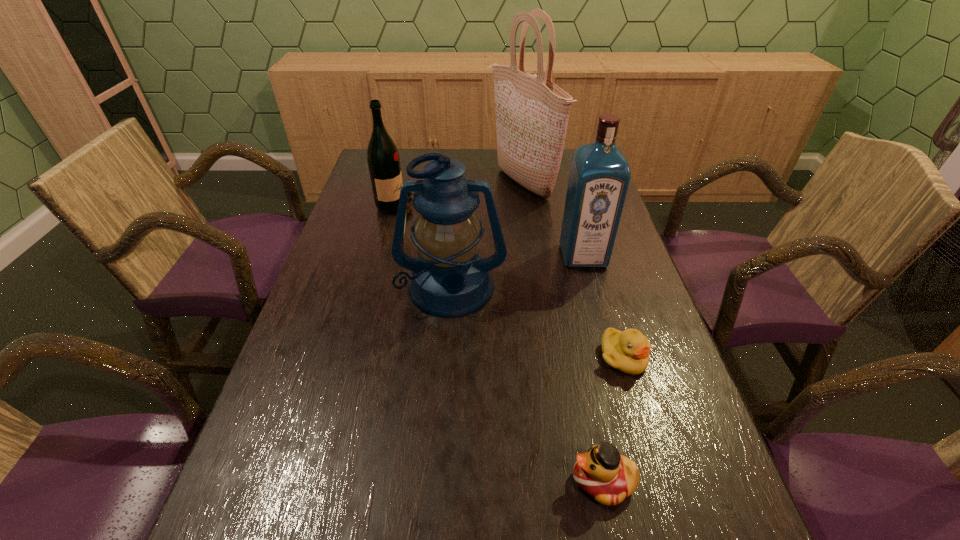
In order to click on duckling present at the right edge in this screenshot , I will do `click(628, 351)`.

Find the location of a particular element. The image size is (960, 540). object that is at the far right corner is located at coordinates (532, 113).

Find the location of a particular element. The height and width of the screenshot is (540, 960). free space at the left edge is located at coordinates (340, 344).

This screenshot has width=960, height=540. What are the coordinates of `free space at the right edge` in the screenshot? It's located at (610, 321).

Locate an element on the screen. The image size is (960, 540). vacant space at the far right corner of the desktop is located at coordinates (559, 179).

Locate an element on the screen. free space between the wine bottle and the shortest object is located at coordinates (511, 281).

This screenshot has height=540, width=960. Find the location of `vacant space that's between the shopping bag and the liquor`. vacant space that's between the shopping bag and the liquor is located at coordinates (552, 219).

The width and height of the screenshot is (960, 540). Find the location of `vacant point located between the liquor and the duck`. vacant point located between the liquor and the duck is located at coordinates (593, 368).

Locate an element on the screen. unoccupied position between the shortest object and the lantern is located at coordinates (538, 322).

At what (x,y) coordinates should I click in order to perform the action: click on free spot between the lantern and the tallest object. Please return your answer as a coordinate pair (x, y). Image resolution: width=960 pixels, height=540 pixels. Looking at the image, I should click on (487, 235).